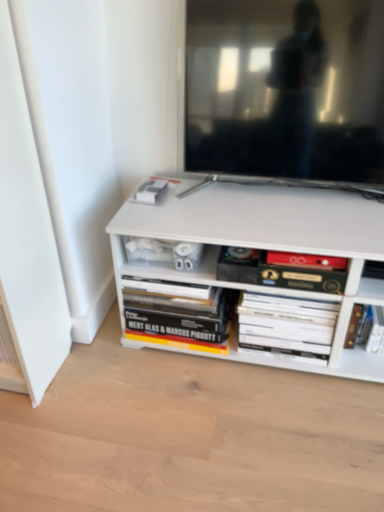
Identify the location of vacant area situated to the left side of hardcover book at lower center, which is the fourth book in right-to-left order. (97, 348).